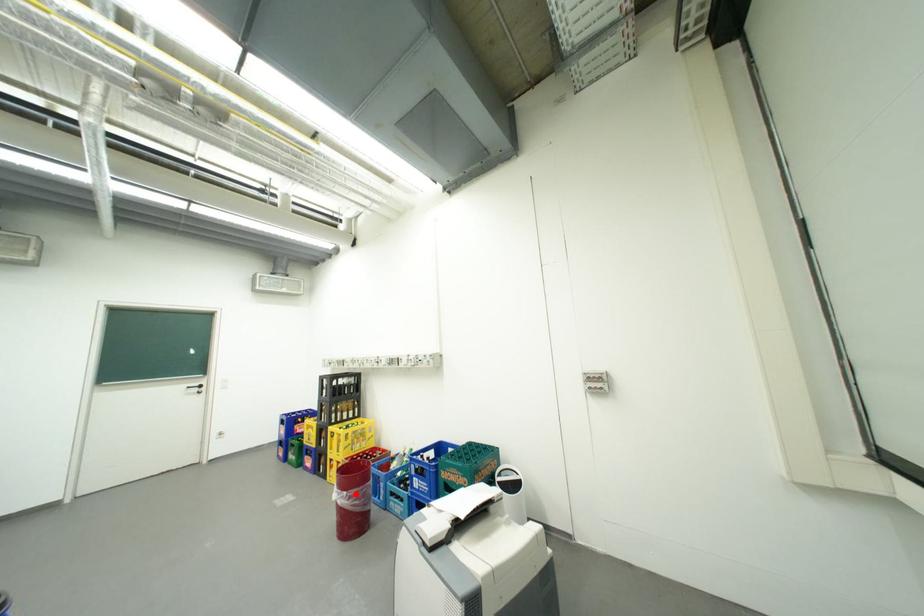
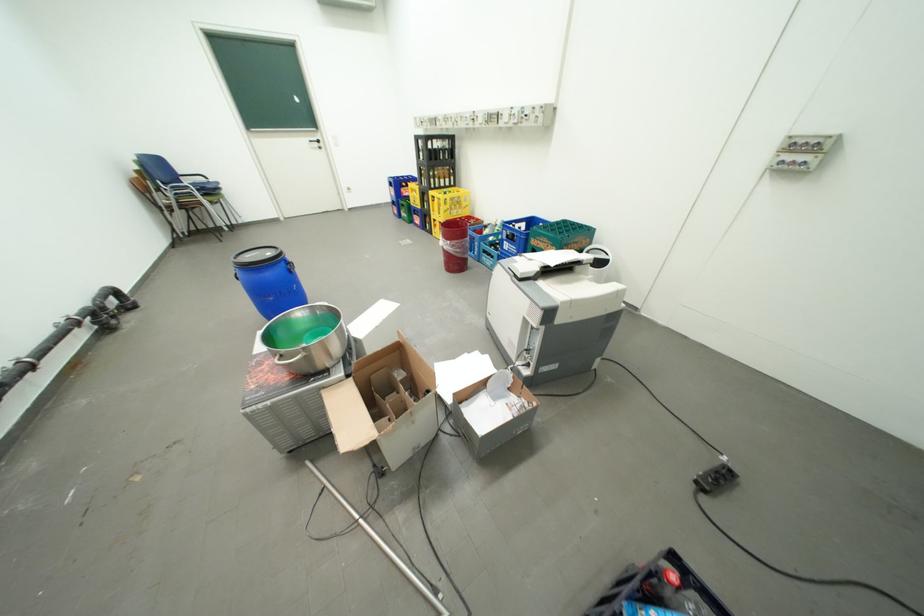
Locate, in the second image, the point that corresponds to the highlighted location in the first image.

(459, 243)